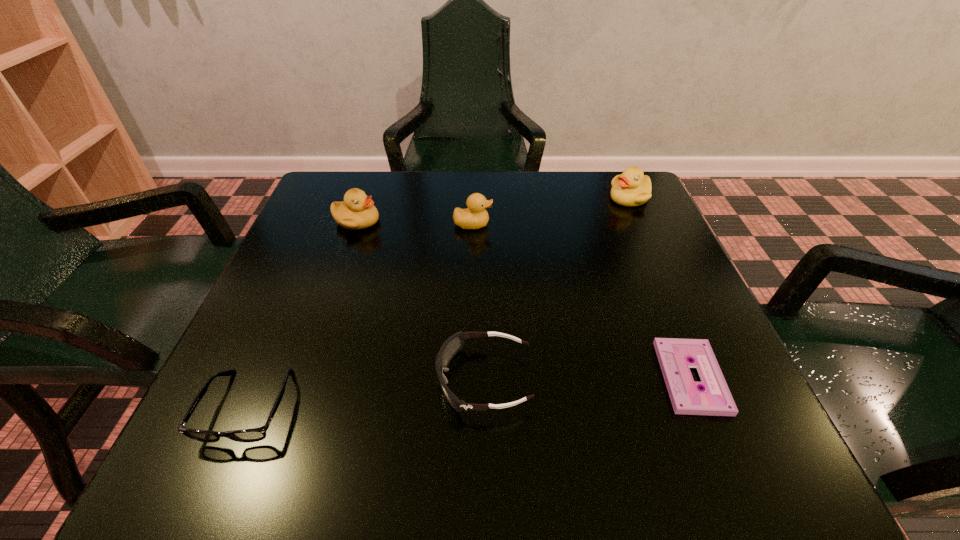
Find the location of a particular element. The image size is (960, 540). the rightmost duckling is located at coordinates (632, 188).

Find the location of `the leftmost duckling`. the leftmost duckling is located at coordinates (357, 211).

Identify the location of the second duckling from right to left. The image size is (960, 540). (475, 216).

You are a GUI agent. You are given a task and a screenshot of the screen. Output one action in this format:
    pyautogui.click(x=<x>, y=<y>)
    Task: Click on the goggles
    
    Given the screenshot: What is the action you would take?
    pyautogui.click(x=453, y=344)

What are the coordinates of `spectacles` in the screenshot? It's located at (255, 434).

This screenshot has width=960, height=540. What are the coordinates of `the shortest object` in the screenshot? It's located at (674, 355).

Locate an element on the screen. free space located 0.300m on the beak of the rightmost duckling is located at coordinates (488, 198).

You are a GUI agent. You are given a task and a screenshot of the screen. Output one action in this format:
    pyautogui.click(x=<x>, y=<y>)
    Task: Click on the vacant region located 0.160m on the beak of the rightmost duckling
    The width and height of the screenshot is (960, 540).
    Given the screenshot: What is the action you would take?
    pyautogui.click(x=544, y=198)

You are a GUI agent. You are given a task and a screenshot of the screen. Output one action in this format:
    pyautogui.click(x=<x>, y=<y>)
    Task: Click on the free point located 0.340m on the beak of the rightmost duckling
    This screenshot has height=540, width=960.
    Given the screenshot: What is the action you would take?
    pyautogui.click(x=471, y=198)

Identify the location of free space located 0.390m on the front-facing side of the leftmost duckling. (549, 221).